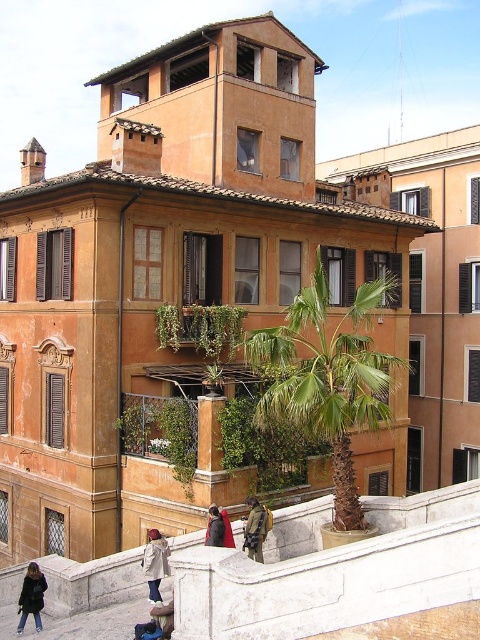
Does green leafy palm at center come in front of red fabric coat at lower center?

Yes, green leafy palm at center is in front of red fabric coat at lower center.

Can you confirm if green leafy palm at center is positioned to the left of red fabric coat at lower center?

No, green leafy palm at center is not to the left of red fabric coat at lower center.

Who is more distant from viewer, (x=282, y=346) or (x=215, y=513)?

The point (x=215, y=513) is behind.

The height and width of the screenshot is (640, 480). Identify the location of green leafy palm at center. (327, 378).

Is green leafy palm at center below dark brown leather jacket at lower left?

Incorrect, green leafy palm at center is not positioned below dark brown leather jacket at lower left.

Image resolution: width=480 pixels, height=640 pixels. What do you see at coordinates (327, 378) in the screenshot? I see `green leafy palm at center` at bounding box center [327, 378].

Identify the location of green leafy palm at center. The width and height of the screenshot is (480, 640). (327, 378).

Which is above, light beige coat at lower center or denim jacket at lower center?

light beige coat at lower center

In the scene shown: Which is below, light beige coat at lower center or denim jacket at lower center?

denim jacket at lower center is below.

Who is more distant from viewer, (156,557) or (158,624)?

The point (156,557) is behind.

You are a GUI agent. You are given a task and a screenshot of the screen. Output one action in this format:
    pyautogui.click(x=<x>, y=<y>)
    Task: Click on the light beige coat at lower center
    The image size is (480, 640).
    Given the screenshot: What is the action you would take?
    pyautogui.click(x=155, y=563)